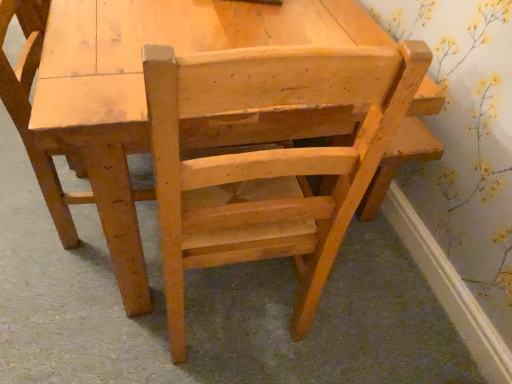
The image size is (512, 384). What are the coordinates of `free space in front of light brown wood chair at center, placed as the second chair when sorted from right to left` in the screenshot? It's located at (68, 291).